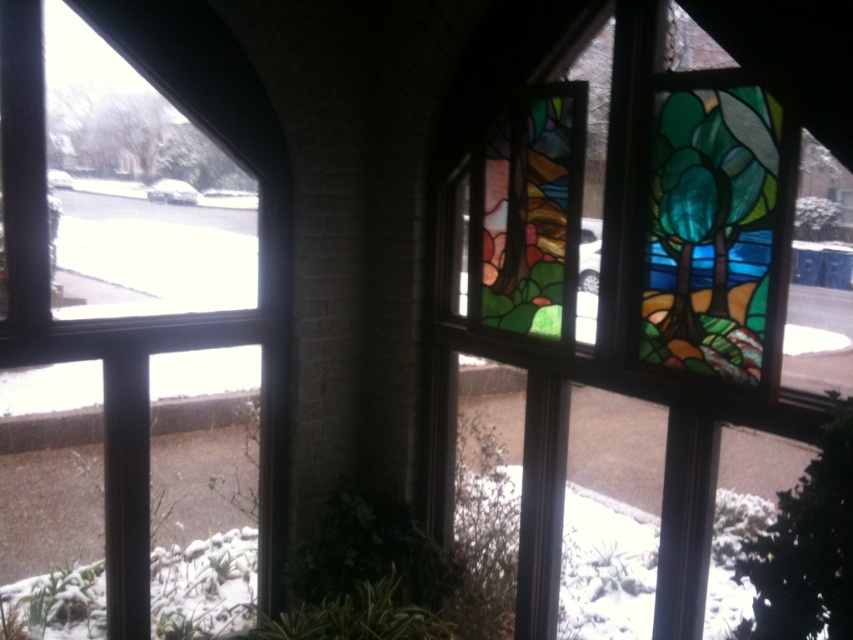
Question: Which object appears farthest from the camera in this image?

Choices:
 (A) stained glass window at center
 (B) clear glass window at upper left

Answer: (B)

Question: Which of the following is the closest to the observer?

Choices:
 (A) clear glass window at upper left
 (B) stained glass window at center

Answer: (B)

Question: Can you confirm if clear glass window at upper left is positioned above stained glass window at center?

Choices:
 (A) no
 (B) yes

Answer: (B)

Question: Can you confirm if clear glass window at upper left is positioned above stained glass window at center?

Choices:
 (A) no
 (B) yes

Answer: (B)

Question: Is clear glass window at upper left behind stained glass window at center?

Choices:
 (A) no
 (B) yes

Answer: (B)